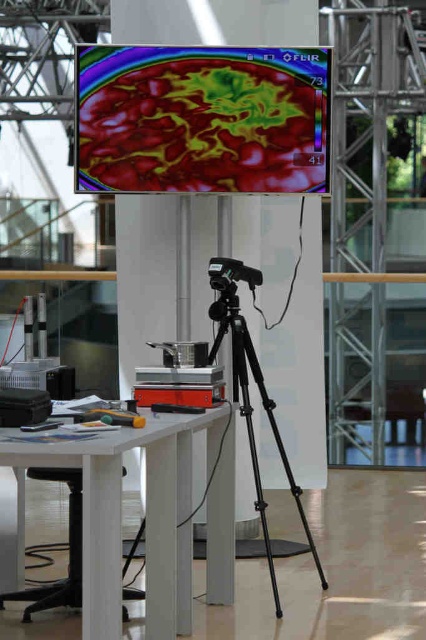
You are an engineer in the conference room. You need to move the black plastic stool at lower left to the other side of the thermal imaging screen at center. Is the stool currently on the left or right side of the screen?

The thermal imaging screen at center is positioned on the right side of black plastic stool at lower left, so the stool is currently on the left side of the screen.

You are setting up equipment in the conference room. You have a white matte table at lower left and a black plastic video camera at center. Which object can you place a large document on?

The white matte table at lower left is larger in size than the black plastic video camera at center, so you can place the large document on the white matte table at lower left.

Consider the image. You are setting up equipment in the conference room and need to know which device is taller between the thermal imaging screen at center and the black plastic video camera at center. Can you tell me?

The thermal imaging screen at center is much taller than the black plastic video camera at center.